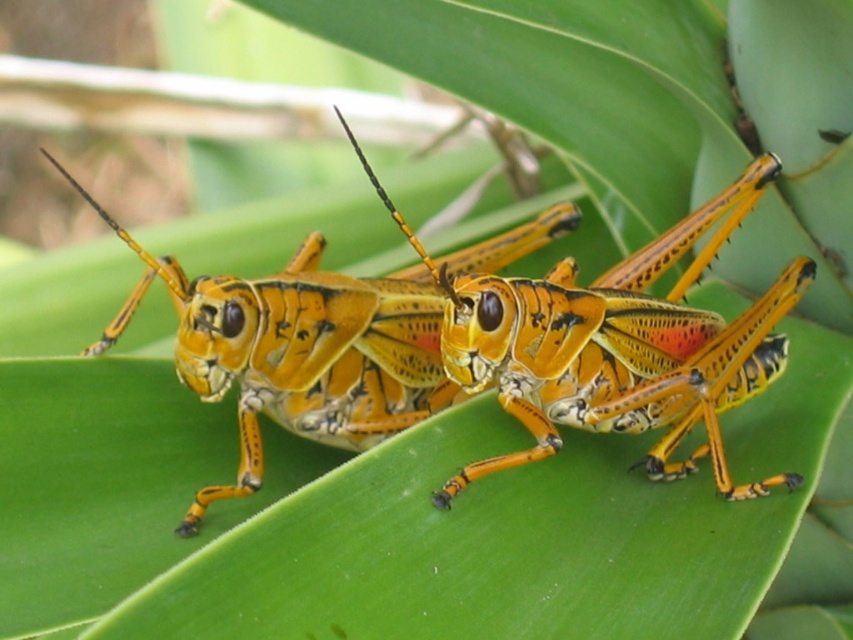
This screenshot has height=640, width=853. What do you see at coordinates (614, 342) in the screenshot?
I see `orange-yellow textured grasshopper at center` at bounding box center [614, 342].

Does orange-yellow textured grasshopper at center appear on the left side of shiny orange grasshopper at center?

No, orange-yellow textured grasshopper at center is not to the left of shiny orange grasshopper at center.

Between point (497, 365) and point (368, 365), which one is positioned in front?

Positioned in front is point (497, 365).

The height and width of the screenshot is (640, 853). I want to click on orange-yellow textured grasshopper at center, so click(614, 342).